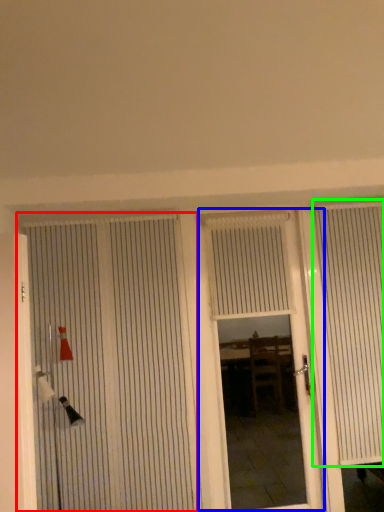
Question: Estimate the real-world distances between objects in this image. Which object is farther from door (highlighted by a red box), door (highlighted by a blue box) or curtain (highlighted by a green box)?

Choices:
 (A) door
 (B) curtain

Answer: (A)